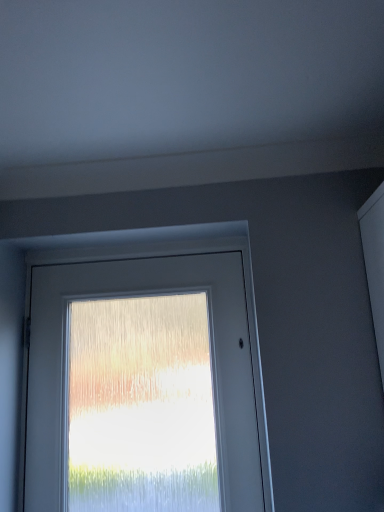
What is the approximate width of white frosted glass door at center?

white frosted glass door at center is 12.89 centimeters in width.

Find the location of a particular element. The width and height of the screenshot is (384, 512). white frosted glass door at center is located at coordinates (211, 365).

This screenshot has height=512, width=384. What do you see at coordinates (211, 365) in the screenshot?
I see `white frosted glass door at center` at bounding box center [211, 365].

Where is `white frosted glass door at center`? white frosted glass door at center is located at coordinates (x=211, y=365).